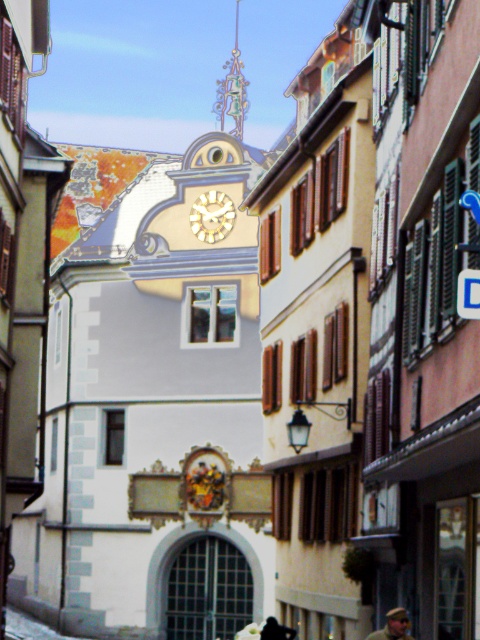
Can you confirm if ornate metal bell tower at upper center is positioned to the right of dark hair at lower center?

Incorrect, ornate metal bell tower at upper center is not on the right side of dark hair at lower center.

Identify the location of ornate metal bell tower at upper center. The image size is (480, 640). (231, 90).

Image resolution: width=480 pixels, height=640 pixels. Identify the location of ornate metal bell tower at upper center. (231, 90).

Can you confirm if ornate metal bell tower at upper center is positioned to the right of blue plastic sign at center?

Incorrect, ornate metal bell tower at upper center is not on the right side of blue plastic sign at center.

Where is `ornate metal bell tower at upper center`? ornate metal bell tower at upper center is located at coordinates (231, 90).

Locate an element on the screen. The image size is (480, 640). ornate metal bell tower at upper center is located at coordinates (231, 90).

Can you confirm if camouflage fabric cap at center is taller than dark hair at lower center?

No.

I want to click on camouflage fabric cap at center, so click(x=393, y=625).

Find the location of a particular element. camouflage fabric cap at center is located at coordinates (393, 625).